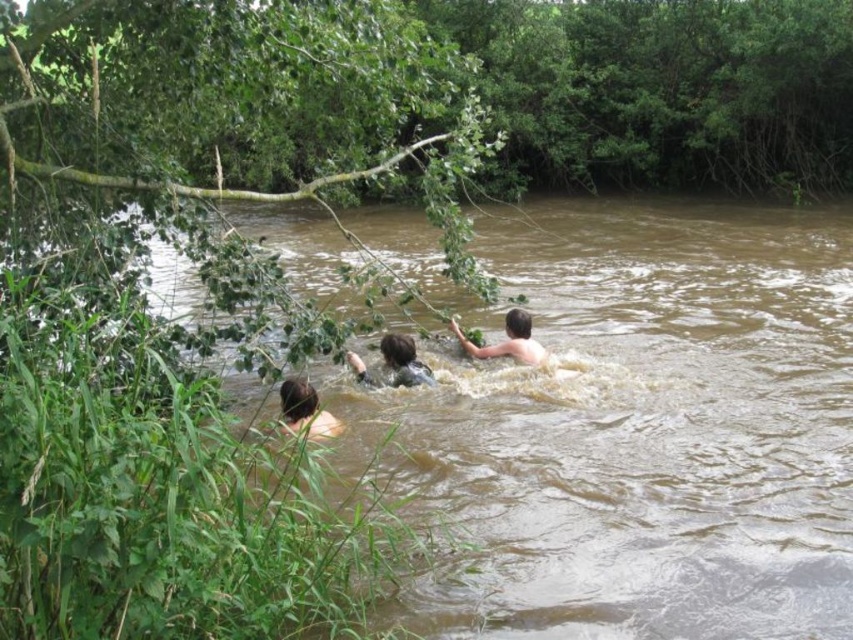
Question: Which object appears farthest from the camera in this image?

Choices:
 (A) light brown skin at center
 (B) dark brown hair at center
 (C) brown skin at lower left

Answer: (A)

Question: Can you confirm if brown muddy water at center is positioned to the right of dark brown hair at center?

Choices:
 (A) yes
 (B) no

Answer: (A)

Question: Can you confirm if dark brown hair at center is bigger than light brown skin at center?

Choices:
 (A) no
 (B) yes

Answer: (A)

Question: Which point is farther to the camera?

Choices:
 (A) brown muddy water at center
 (B) dark brown hair at center
 (C) light brown skin at center
 (D) brown skin at lower left

Answer: (C)

Question: Can you confirm if dark brown hair at center is positioned above light brown skin at center?

Choices:
 (A) no
 (B) yes

Answer: (A)

Question: Which point is farther to the camera?

Choices:
 (A) brown skin at lower left
 (B) light brown skin at center

Answer: (B)